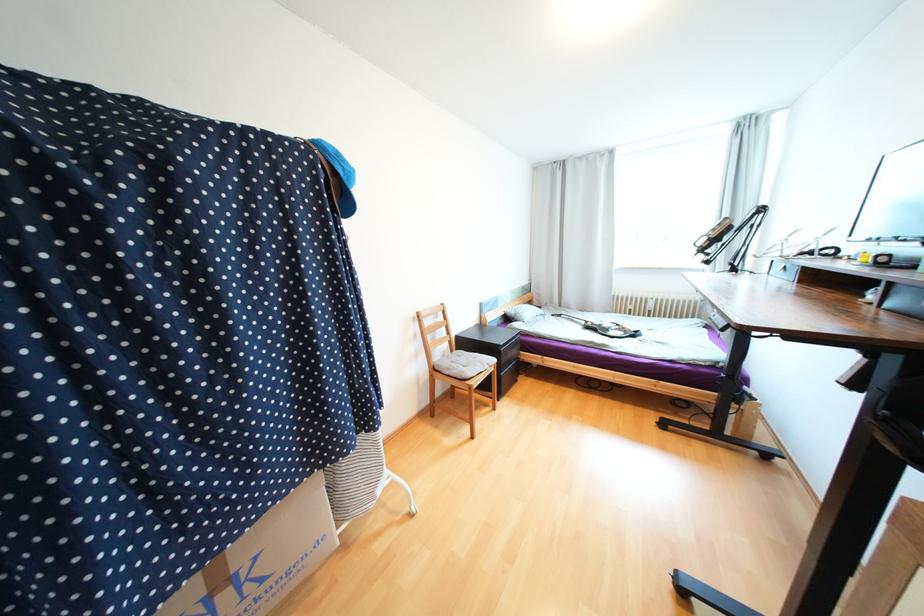
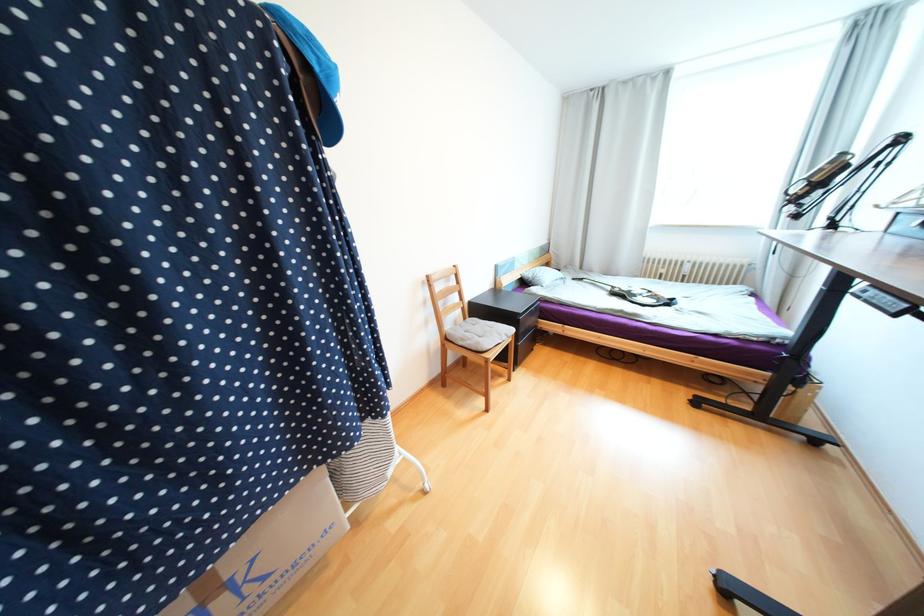
In the second image, find the point that corresponds to point (590, 323) in the first image.

(614, 288)